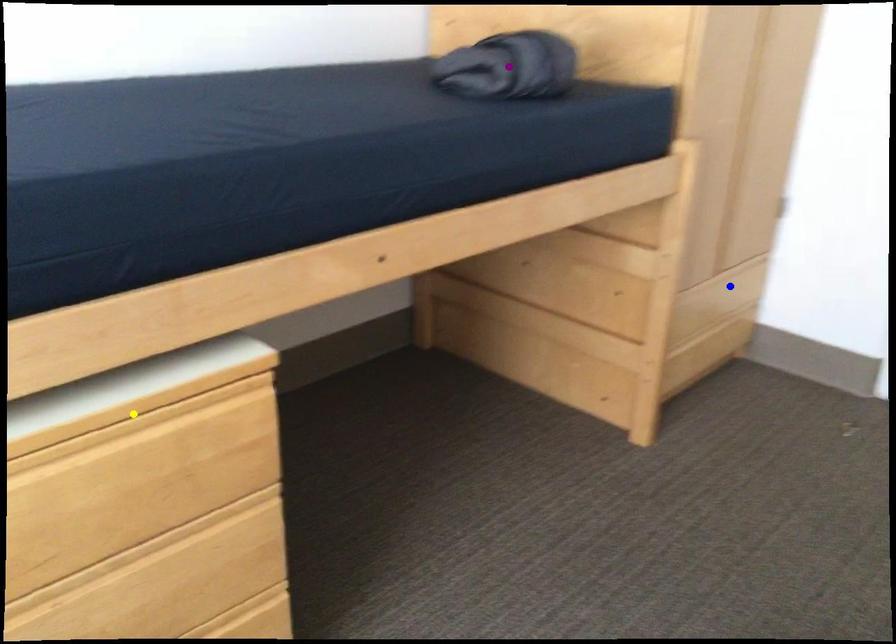
Order these from farthest to nearest:
yellow point | blue point | purple point

1. blue point
2. purple point
3. yellow point